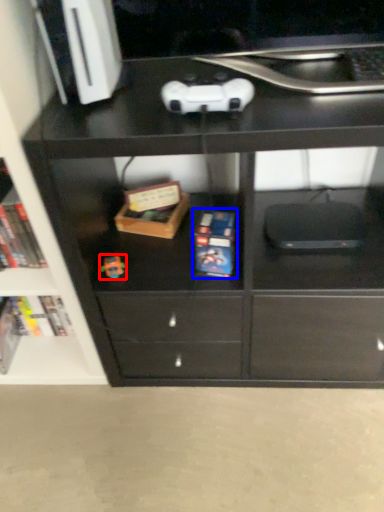
Question: Which object is further to the camera taking this photo, toy (highlighted by a red box) or paperback book (highlighted by a blue box)?

Choices:
 (A) toy
 (B) paperback book

Answer: (A)